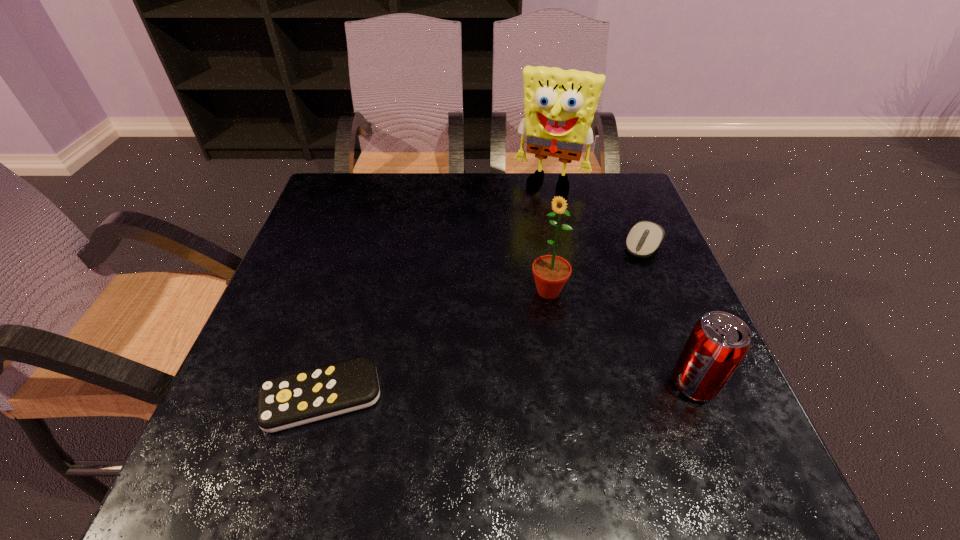
This screenshot has height=540, width=960. Identify the location of object situated at the far edge. (560, 104).

Image resolution: width=960 pixels, height=540 pixels. I want to click on remote control located at the near edge, so click(287, 401).

Where is `soda can located in the near edge section of the desktop`? soda can located in the near edge section of the desktop is located at coordinates (718, 342).

Identify the location of object situated at the left edge. [x=287, y=401].

The height and width of the screenshot is (540, 960). In order to click on soda can that is at the right edge in this screenshot , I will do `click(718, 342)`.

At what (x,y) coordinates should I click in order to perform the action: click on computer equipment that is at the right edge. Please return your answer as a coordinate pair (x, y). Looking at the image, I should click on 644,238.

Identify the location of sponge that is positioned at the right edge. The width and height of the screenshot is (960, 540). (560, 104).

I want to click on object at the near left corner, so click(x=287, y=401).

Where is `object that is at the far right corner`? The height and width of the screenshot is (540, 960). object that is at the far right corner is located at coordinates click(x=560, y=104).

Identify the location of object at the near right corner. click(718, 342).